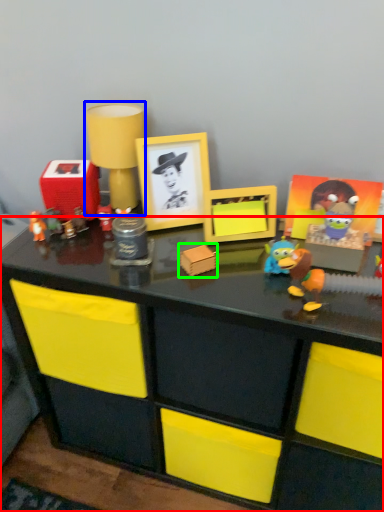
Question: Based on their relative distances, which object is farther from desk (highlighted by a red box)? Choose from toy (highlighted by a blue box) and toy (highlighted by a green box).

Choices:
 (A) toy
 (B) toy

Answer: (A)